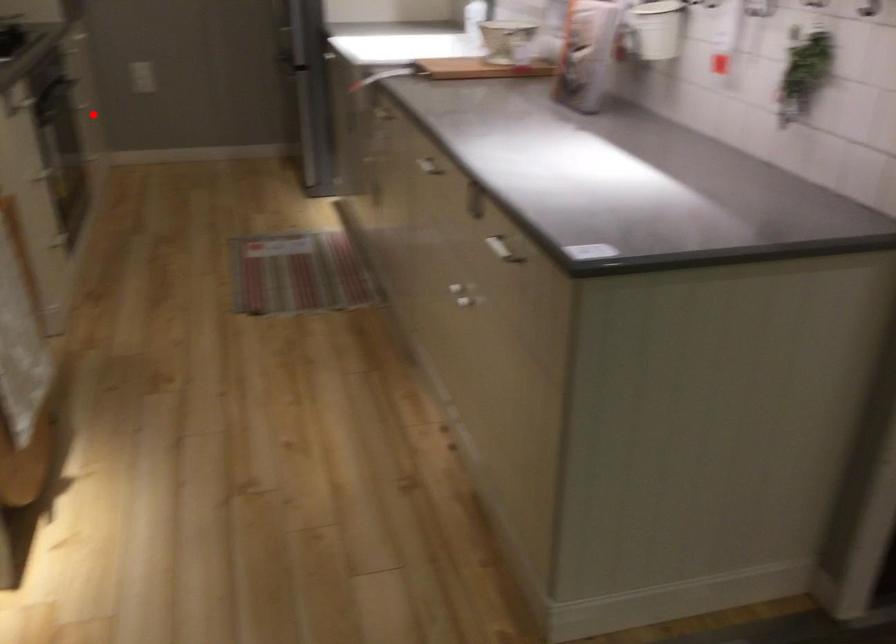
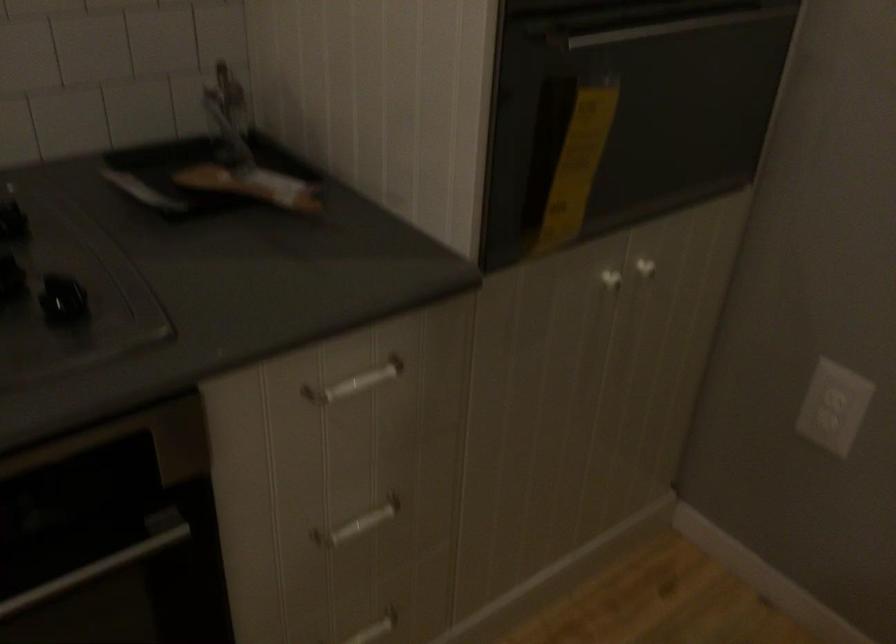
Question: I am providing you with two images of the same scene from different viewpoints. A red point is shown in image1. For the corresponding object point in image2, is it positioned nearer or farther from the camera?

Choices:
 (A) Nearer
 (B) Farther

Answer: (A)